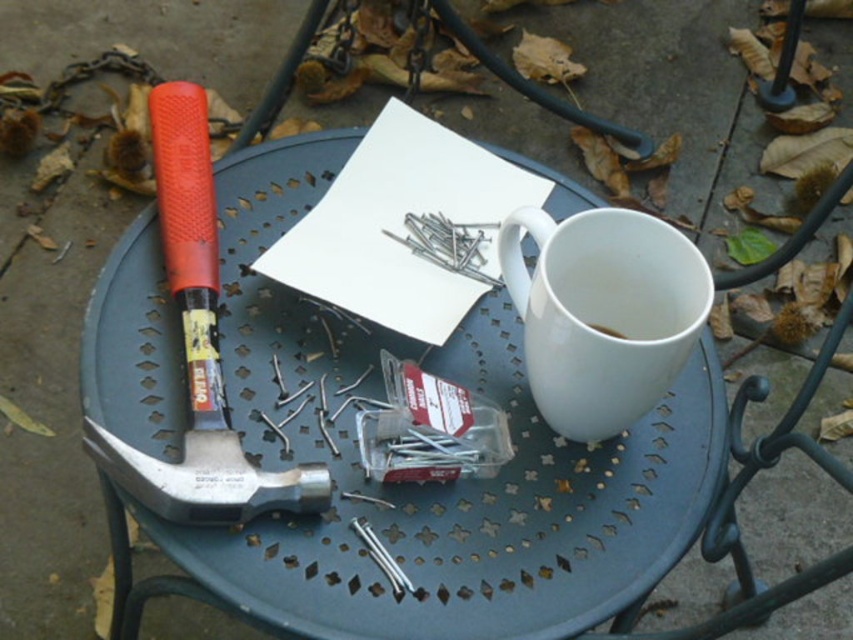
Based on the photo, who is positioned more to the right, metallic gray table at center or rubberized metal hammer at left?

From the viewer's perspective, metallic gray table at center appears more on the right side.

Looking at this image, which is above, metallic gray table at center or rubberized metal hammer at left?

rubberized metal hammer at left

Is point (253, 522) closer to viewer compared to point (317, 472)?

No, (253, 522) is further to viewer.

Identify the location of metallic gray table at center. The height and width of the screenshot is (640, 853). (426, 483).

Can you confirm if metallic gray table at center is thinner than white matte cup at upper right?

In fact, metallic gray table at center might be wider than white matte cup at upper right.

Between point (483, 509) and point (590, 324), which one is positioned in front?

Point (483, 509) is in front.

At what (x,y) coordinates should I click in order to perform the action: click on metallic gray table at center. Please return your answer as a coordinate pair (x, y). The image size is (853, 640). Looking at the image, I should click on (426, 483).

Which is behind, point (566, 412) or point (196, 90)?

Positioned behind is point (196, 90).

Which is more to the left, white ceramic mug at right or rubberized metal hammer at left?

rubberized metal hammer at left is more to the left.

The image size is (853, 640). Describe the element at coordinates (602, 314) in the screenshot. I see `white ceramic mug at right` at that location.

This screenshot has width=853, height=640. Identify the location of white ceramic mug at right. (602, 314).